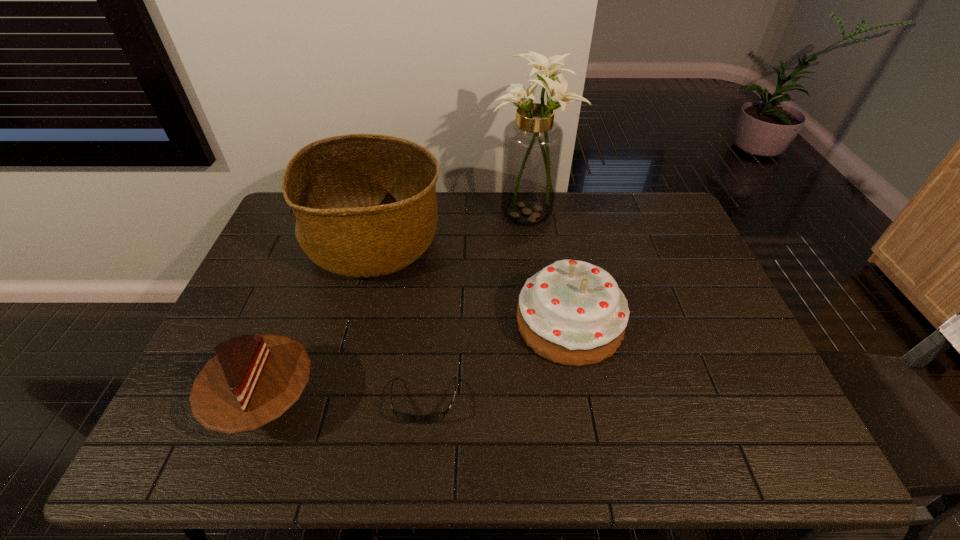
I want to click on flower arrangement at the far edge, so click(532, 144).

Where is `basket that is at the far edge`? basket that is at the far edge is located at coordinates (366, 206).

Identify the location of cake that is at the near edge. (252, 380).

Image resolution: width=960 pixels, height=540 pixels. Find the location of `sunglasses that is at the near edge`. sunglasses that is at the near edge is located at coordinates point(436,417).

You are a GUI agent. You are given a task and a screenshot of the screen. Output one action in this format:
    pyautogui.click(x=<x>, y=<y>)
    Task: Click on the basket located at the left edge
    The width and height of the screenshot is (960, 540).
    Given the screenshot: What is the action you would take?
    pyautogui.click(x=366, y=206)

Where is `cake that is at the left edge`? This screenshot has width=960, height=540. cake that is at the left edge is located at coordinates (252, 380).

Identify the location of object positioned at the far left corner. The image size is (960, 540). (366, 206).

I want to click on object that is at the near left corner, so click(252, 380).

The image size is (960, 540). In order to click on free space at the far edge of the desktop in this screenshot , I will do `click(595, 224)`.

At what (x,y) coordinates should I click in order to perform the action: click on vacant space at the near edge of the desktop. Please return your answer as a coordinate pair (x, y). The width and height of the screenshot is (960, 540). Looking at the image, I should click on (448, 457).